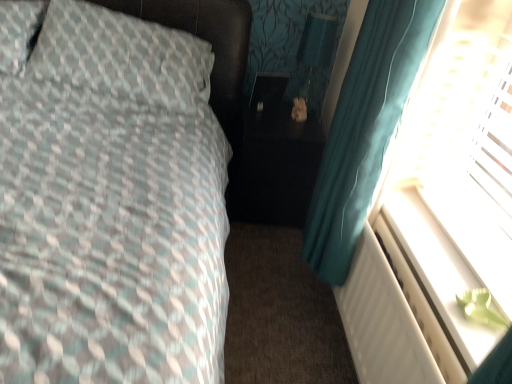
Question: From the image's perspective, is white plastic radiator at lower right above or below transparent plastic screen at right?

Choices:
 (A) above
 (B) below

Answer: (B)

Question: Based on their positions, is white plastic radiator at lower right located to the left or right of transparent plastic screen at right?

Choices:
 (A) right
 (B) left

Answer: (B)

Question: Which object is the closest to the teal fabric curtain at right?

Choices:
 (A) matte black table lamp at center
 (B) black glossy side table at center
 (C) transparent plastic screen at right
 (D) white plastic radiator at lower right
 (E) textured fabric pillow at left

Answer: (C)

Question: Estimate the real-world distances between objects in this image. Which object is farther from the white plastic radiator at lower right?

Choices:
 (A) black glossy side table at center
 (B) matte black table lamp at center
 (C) textured fabric pillow at left
 (D) teal fabric curtain at right
 (E) transparent plastic screen at right

Answer: (B)